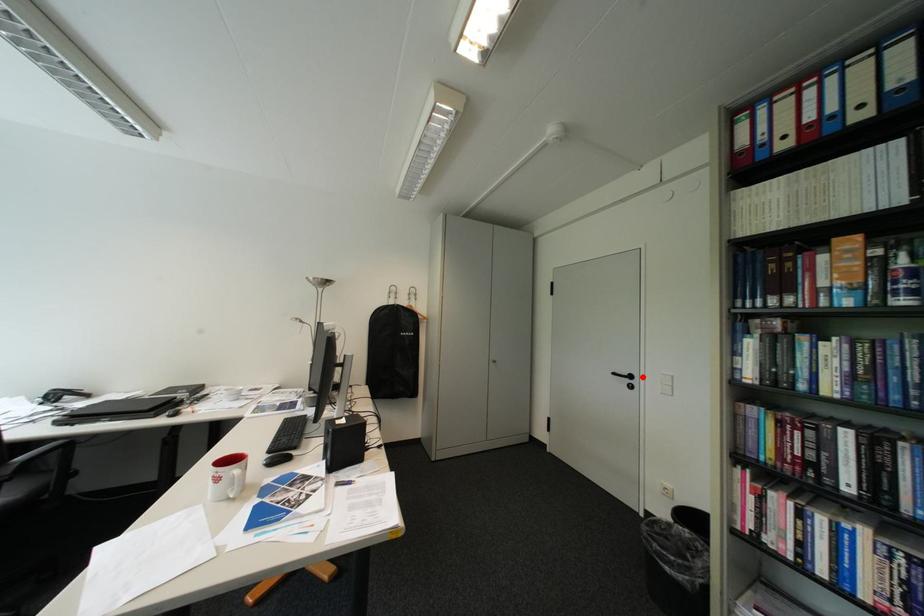
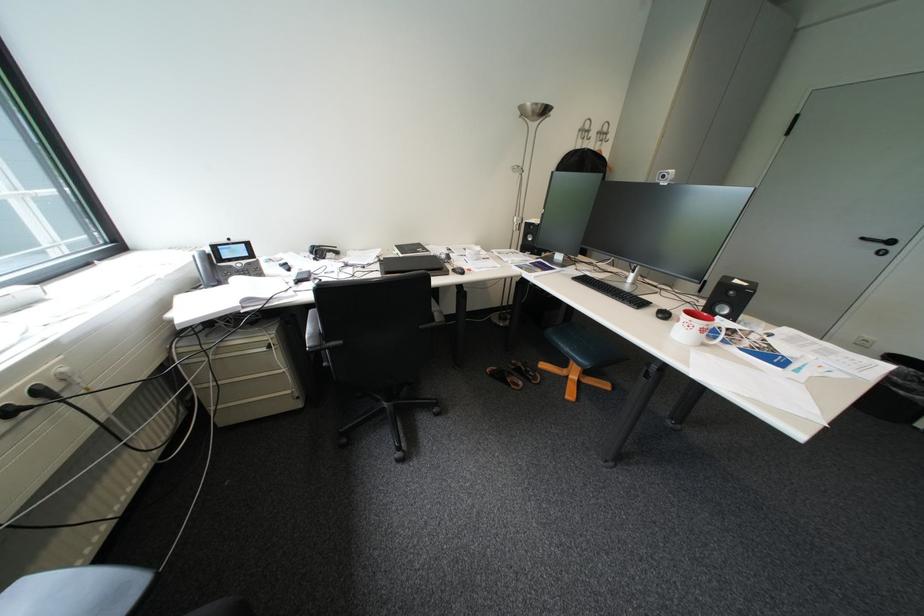
Question: I am providing you with two images of the same scene from different viewpoints. Given a red point in image1, look at the same physical point in image2. Is it:

Choices:
 (A) Closer to the viewpoint
 (B) Farther from the viewpoint

Answer: (B)